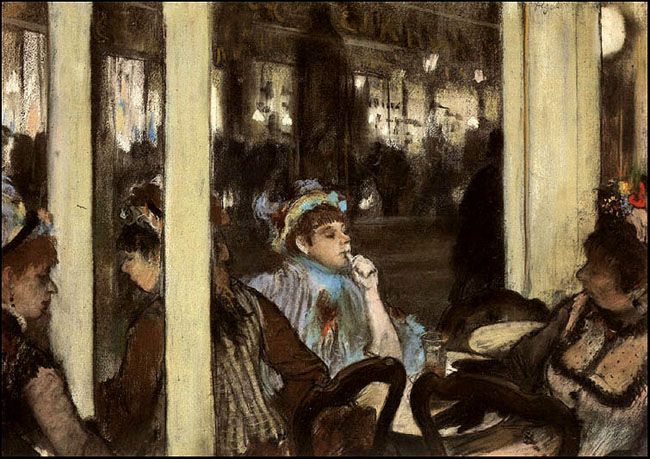
You are a GUI agent. You are given a task and a screenshot of the screen. Output one action in this format:
    pyautogui.click(x=<x>, y=<y>)
    Task: Click on the pillar
    This screenshot has height=459, width=650.
    Given the screenshot: What is the action you would take?
    pyautogui.click(x=560, y=130), pyautogui.click(x=199, y=195), pyautogui.click(x=69, y=197)